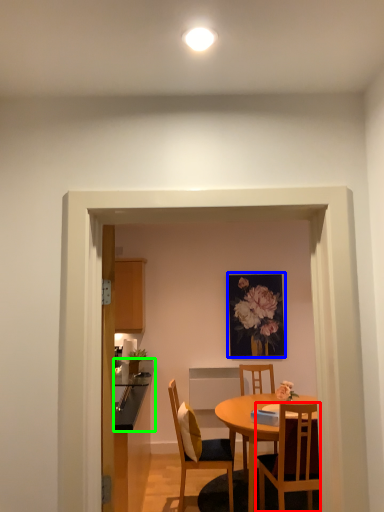
Question: Which object is positioned farthest from chair (highlighted by a red box)? Select from picture frame (highlighted by a blue box) and counter top (highlighted by a green box).

Choices:
 (A) picture frame
 (B) counter top

Answer: (A)